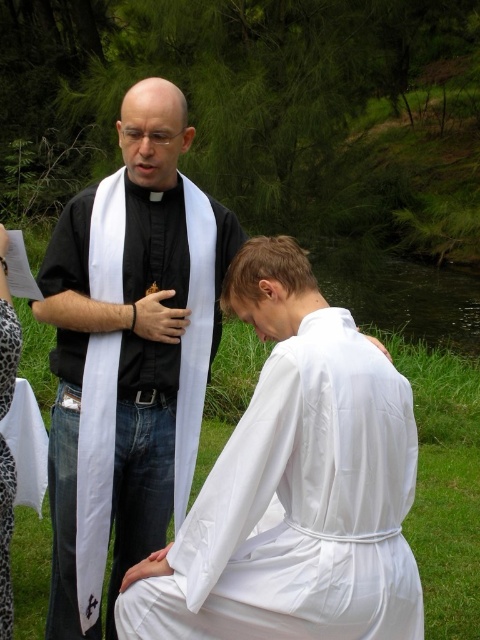
Is point (364, 365) positioned in front of point (3, 365)?

Yes, it is in front of point (3, 365).

Is point (361, 388) positioned after point (9, 621)?

No, (361, 388) is in front of (9, 621).

Does point (253, 484) lie behind point (12, 608)?

No, (253, 484) is closer to viewer.

I want to click on white cotton robe at lower center, so click(x=300, y=508).

Who is lower down, white cotton robe at lower center or black matte vestment at center?

white cotton robe at lower center is lower down.

Is point (162, 616) closer to camera compared to point (208, 369)?

That is True.

This screenshot has width=480, height=640. What do you see at coordinates (300, 508) in the screenshot?
I see `white cotton robe at lower center` at bounding box center [300, 508].

Locate an element on the screen. The height and width of the screenshot is (640, 480). white cotton robe at lower center is located at coordinates (300, 508).

Between black matte vestment at center and leopard print dress at lower left, which one appears on the left side from the viewer's perspective?

leopard print dress at lower left is more to the left.

Between black matte vestment at center and leopard print dress at lower left, which one is positioned higher?

Positioned higher is black matte vestment at center.

Which is in front, point (76, 413) or point (3, 493)?

Positioned in front is point (3, 493).

At what (x,y) coordinates should I click in order to perform the action: click on black matte vestment at center. Please return your answer as a coordinate pair (x, y). The height and width of the screenshot is (640, 480). Looking at the image, I should click on (129, 352).